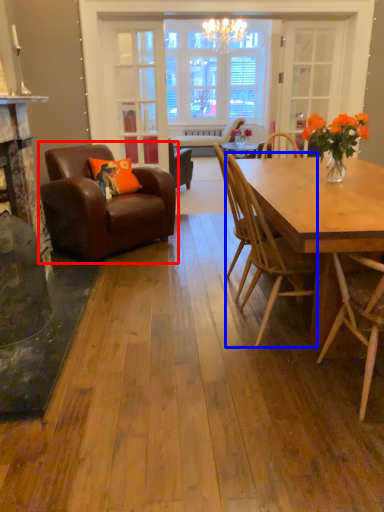
Question: Which point is further to the camera, chair (highlighted by a red box) or chair (highlighted by a blue box)?

Choices:
 (A) chair
 (B) chair

Answer: (A)